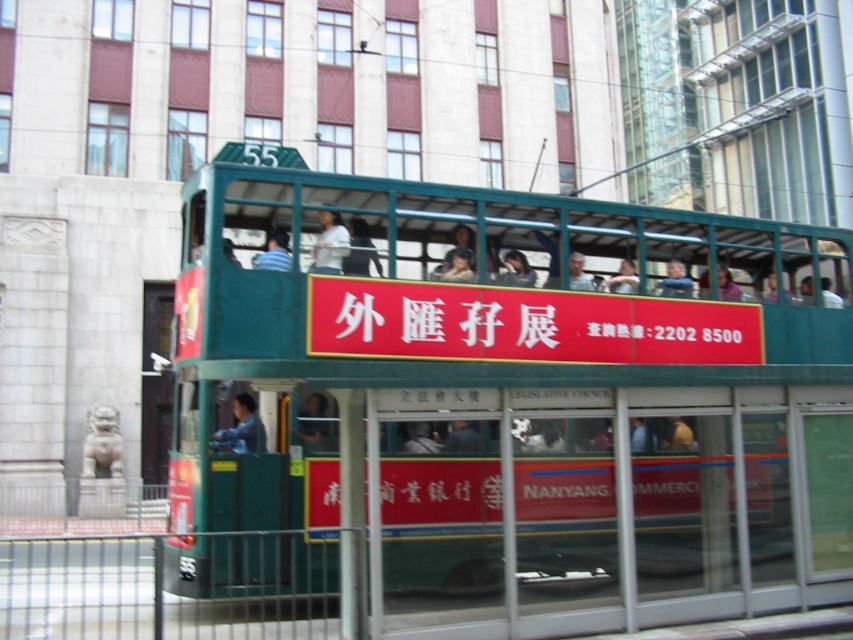
Does point (335, 241) come in front of point (323, 440)?

Yes, point (335, 241) is closer to viewer.

Is point (318, 259) more distant than point (305, 436)?

No, (318, 259) is in front of (305, 436).

Between point (345, 250) and point (329, 432), which one is positioned in front?

Point (345, 250)

Find the location of a particular element. The image size is (853, 640). light blue fabric shirt at center is located at coordinates (329, 243).

Between matte green bus at center and matte black face at center, which one has less height?

Standing shorter between the two is matte green bus at center.

Based on the photo, between matte green bus at center and matte black face at center, which one appears on the left side from the viewer's perspective?

From the viewer's perspective, matte black face at center appears more on the left side.

At what (x,y) coordinates should I click in order to perform the action: click on matte green bus at center. Please return your answer as a coordinate pair (x, y). Looking at the image, I should click on (675, 282).

Identify the location of matte green bus at center. This screenshot has width=853, height=640. (675, 282).

Can you confirm if blue striped shirt at center is positioned to the right of matte green bus at center?

Incorrect, blue striped shirt at center is not on the right side of matte green bus at center.

Can you confirm if blue striped shirt at center is positioned to the left of matte green bus at center?

Correct, you'll find blue striped shirt at center to the left of matte green bus at center.

What do you see at coordinates (274, 253) in the screenshot? I see `blue striped shirt at center` at bounding box center [274, 253].

Find the location of a particular element. This screenshot has width=853, height=640. blue striped shirt at center is located at coordinates tap(274, 253).